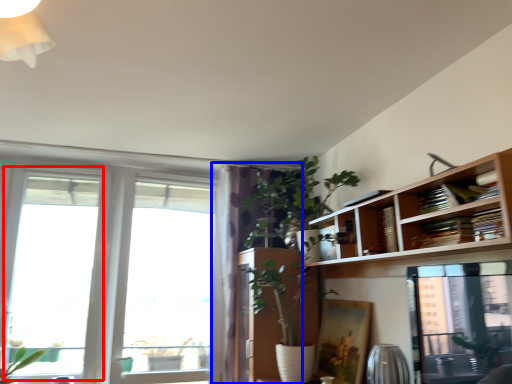
Question: Which of the following is the closest to the observer, window (highlighted by a red box) or curtain (highlighted by a blue box)?

Choices:
 (A) window
 (B) curtain

Answer: (A)